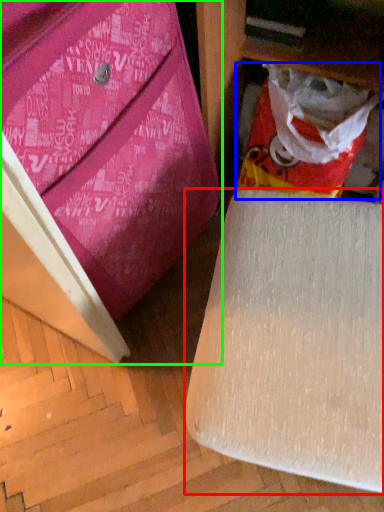
Question: Considering the real-world distances, which object is closest to furniture (highlighted by a red box)? shopping bag (highlighted by a blue box) or furniture (highlighted by a green box).

Choices:
 (A) shopping bag
 (B) furniture

Answer: (B)